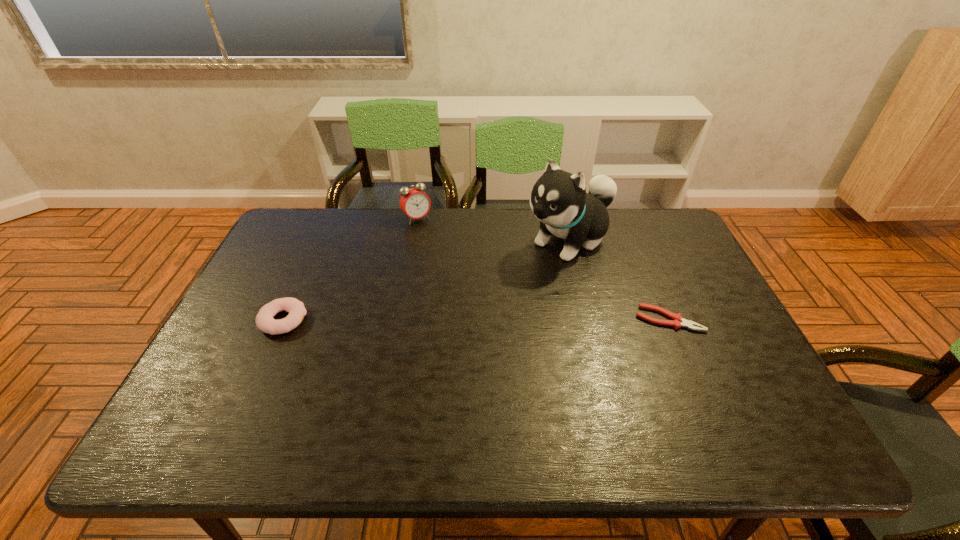
This screenshot has width=960, height=540. I want to click on free area in between the third tallest object and the tallest object, so click(x=426, y=280).

Where is `free space between the shortest object and the second tallest object`? This screenshot has width=960, height=540. free space between the shortest object and the second tallest object is located at coordinates [542, 269].

Find the location of a particular element. This screenshot has width=960, height=540. free spot between the pliers and the doughnut is located at coordinates (476, 320).

The height and width of the screenshot is (540, 960). I want to click on free space between the alarm clock and the shortest object, so (x=542, y=269).

The height and width of the screenshot is (540, 960). What are the coordinates of `vacant space that's between the third tallest object and the third object from right to left` in the screenshot? It's located at (350, 269).

Locate an element on the screen. object that stands as the second closest to the puppy is located at coordinates (414, 202).

Identify which object is the second closest to the second tallest object. Please provide its 2D coordinates. Your answer should be formatted as a tuple, i.e. [(x, y)], where the tuple contains the x and y coordinates of a point satisfying the conditions above.

[(265, 322)]

Identify the location of vacant space that satisfies the following two spatial constraints: 1. on the back side of the doughnut; 2. on the left side of the pliers. (283, 319).

At what (x,y) coordinates should I click in order to perform the action: click on free space that satisfies the following two spatial constraints: 1. on the back side of the tallest object; 2. on the right side of the doughnut. Please return your answer as a coordinate pair (x, y). The width and height of the screenshot is (960, 540). Looking at the image, I should click on (319, 240).

Where is `free space that satisfies the following two spatial constraints: 1. on the back side of the third tallest object; 2. on the right side of the shortest object`? free space that satisfies the following two spatial constraints: 1. on the back side of the third tallest object; 2. on the right side of the shortest object is located at coordinates (283, 319).